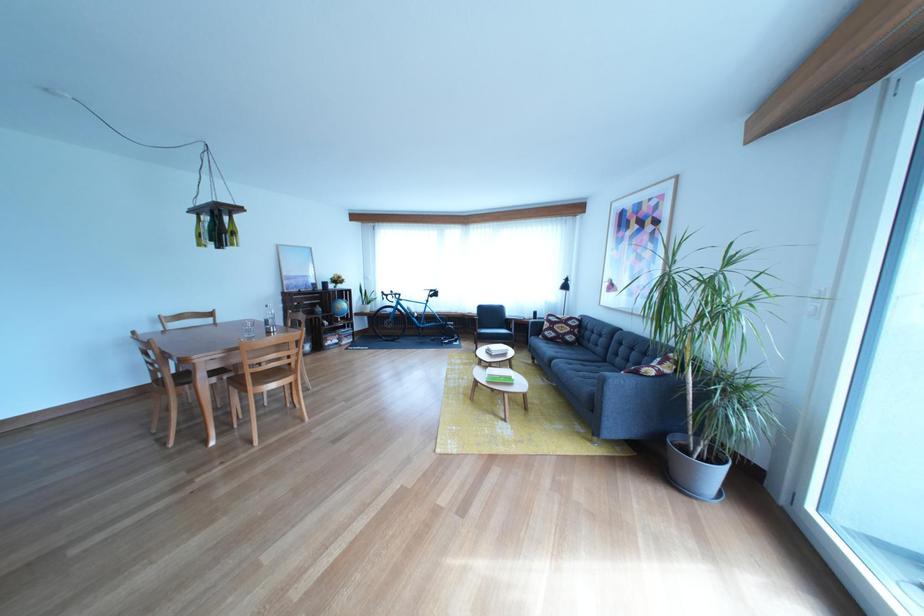
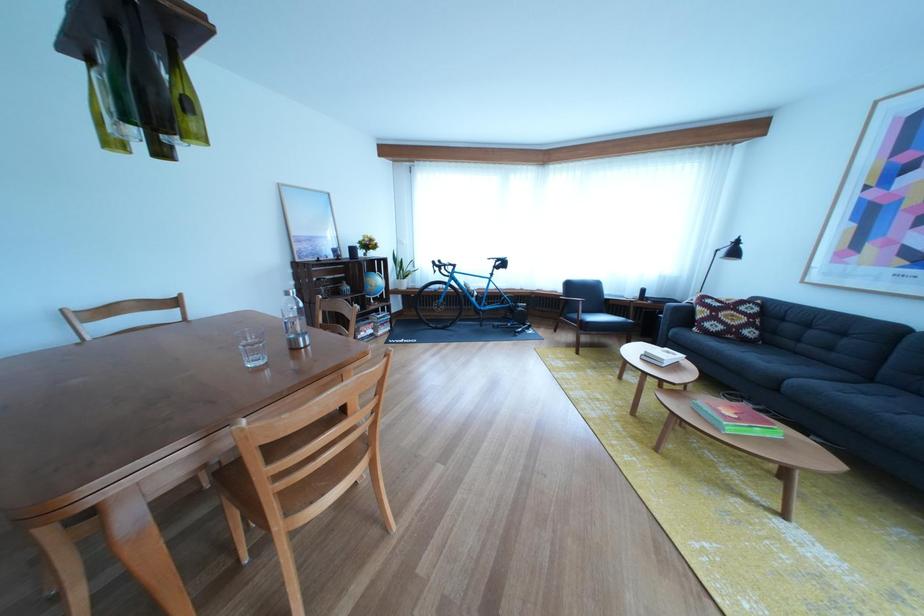
Locate, in the second image, the point that corresponds to point 581,334 in the first image.

(757, 325)